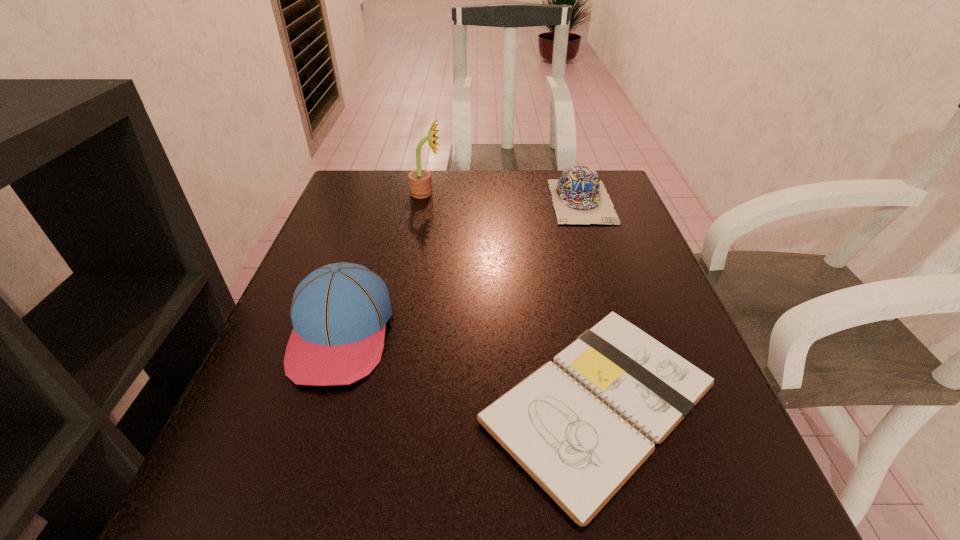
You are a GUI agent. You are given a task and a screenshot of the screen. Output one action in this format:
    pyautogui.click(x=<x>, y=<y>)
    Task: Click on the object situated at the near edge
    Image resolution: width=960 pixels, height=540 pixels.
    Given the screenshot: What is the action you would take?
    pyautogui.click(x=580, y=426)

Identify the location of object at the left edge. This screenshot has height=540, width=960. (339, 312).

Locate an element on the screen. Image resolution: width=960 pixels, height=540 pixels. cap at the right edge is located at coordinates (579, 197).

Locate an element on the screen. notepad that is at the right edge is located at coordinates (580, 426).

Find the location of a particular element. The image size is (960, 540). object present at the far right corner is located at coordinates (579, 197).

The image size is (960, 540). I want to click on object that is at the near right corner, so [x=580, y=426].

Identify the location of vacant area at the far edge of the desktop. Image resolution: width=960 pixels, height=540 pixels. 538,205.

Locate an element on the screen. The image size is (960, 540). vacant area at the left edge of the desktop is located at coordinates pos(347,220).

I want to click on free spot at the right edge of the desktop, so click(x=643, y=283).

At what (x,y) coordinates should I click in order to perform the action: click on vacant space at the far left corner of the desktop. Please return your answer as a coordinate pair (x, y). Looking at the image, I should click on (352, 183).